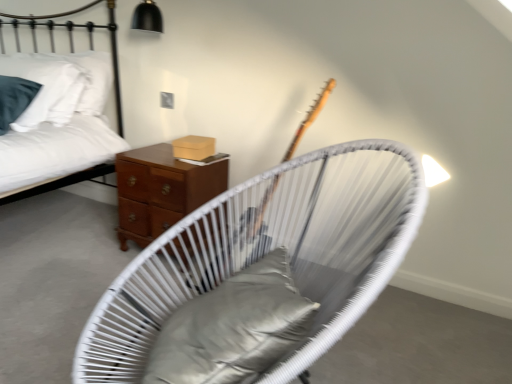
Question: Is white woven chair at center thinner than mahogany wood nightstand at center?

Choices:
 (A) no
 (B) yes

Answer: (A)

Question: Does white woven chair at center lie behind mahogany wood nightstand at center?

Choices:
 (A) yes
 (B) no

Answer: (B)

Question: From the image's perspective, is white woven chair at center located above mahogany wood nightstand at center?

Choices:
 (A) no
 (B) yes

Answer: (A)

Question: Is white woven chair at center located outside mahogany wood nightstand at center?

Choices:
 (A) no
 (B) yes

Answer: (B)

Question: Is white woven chair at center turned away from mahogany wood nightstand at center?

Choices:
 (A) no
 (B) yes

Answer: (A)

Question: Is white woven chair at center far from mahogany wood nightstand at center?

Choices:
 (A) yes
 (B) no

Answer: (B)

Question: Considering the relative sizes of mahogany wood nightstand at center and satin gray pillow at center in the image provided, is mahogany wood nightstand at center shorter than satin gray pillow at center?

Choices:
 (A) no
 (B) yes

Answer: (A)

Question: From a real-world perspective, is mahogany wood nightstand at center over satin gray pillow at center?

Choices:
 (A) yes
 (B) no

Answer: (B)

Question: Is mahogany wood nightstand at center at the right side of satin gray pillow at center?

Choices:
 (A) no
 (B) yes

Answer: (A)

Question: From the image's perspective, is mahogany wood nightstand at center on satin gray pillow at center?

Choices:
 (A) no
 (B) yes

Answer: (B)

Question: Is mahogany wood nightstand at center smaller than satin gray pillow at center?

Choices:
 (A) no
 (B) yes

Answer: (A)

Question: Is mahogany wood nightstand at center looking in the opposite direction of satin gray pillow at center?

Choices:
 (A) no
 (B) yes

Answer: (A)

Question: Does satin gray pillow at center have a larger size compared to mahogany wood nightstand at center?

Choices:
 (A) yes
 (B) no

Answer: (B)